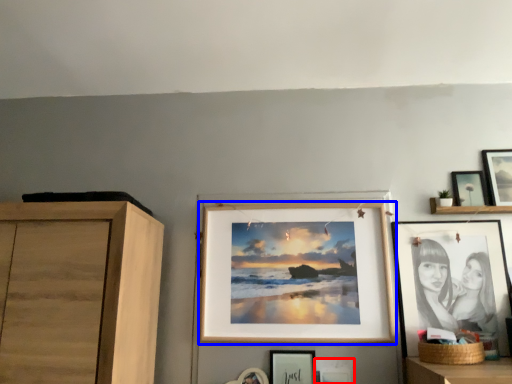
Question: Which object is closer to the camera taking this photo, picture frame (highlighted by a red box) or picture frame (highlighted by a blue box)?

Choices:
 (A) picture frame
 (B) picture frame

Answer: (A)